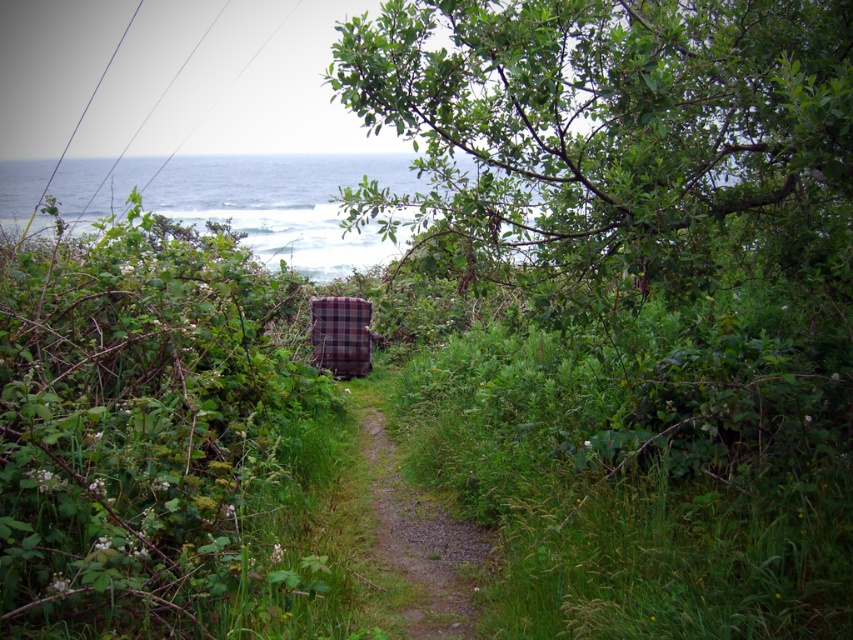
Can you confirm if green leafy tree at upper center is positioned below plaid fabric armchair at center?

Incorrect, green leafy tree at upper center is not positioned below plaid fabric armchair at center.

Does point (637, 49) come in front of point (316, 310)?

Yes, point (637, 49) is closer to viewer.

Does point (552, 3) come closer to viewer compared to point (325, 305)?

That is True.

At what (x,y) coordinates should I click in order to perform the action: click on green leafy tree at upper center. Please return your answer as a coordinate pair (x, y). The image size is (853, 640). Looking at the image, I should click on point(616,131).

Is green leafy tree at upper center bigger than gravelly dirt path at center?

Yes.

Is point (778, 19) closer to viewer compared to point (412, 595)?

No, (778, 19) is further to viewer.

Does point (625, 140) come in front of point (471, 572)?

No.

The height and width of the screenshot is (640, 853). Find the location of `green leafy tree at upper center`. green leafy tree at upper center is located at coordinates (616, 131).

Does plaid fabric chair at center have a smaller size compared to plaid fabric armchair at center?

Yes.

Between plaid fabric chair at center and plaid fabric armchair at center, which one has less height?

Standing shorter between the two is plaid fabric chair at center.

Based on the photo, measure the distance between point (x=30, y=410) and camera.

The distance of point (x=30, y=410) from camera is 3.14 meters.

At what (x,y) coordinates should I click in order to perform the action: click on plaid fabric chair at center. Please return your answer as a coordinate pair (x, y). This screenshot has width=853, height=640. Looking at the image, I should click on (149, 436).